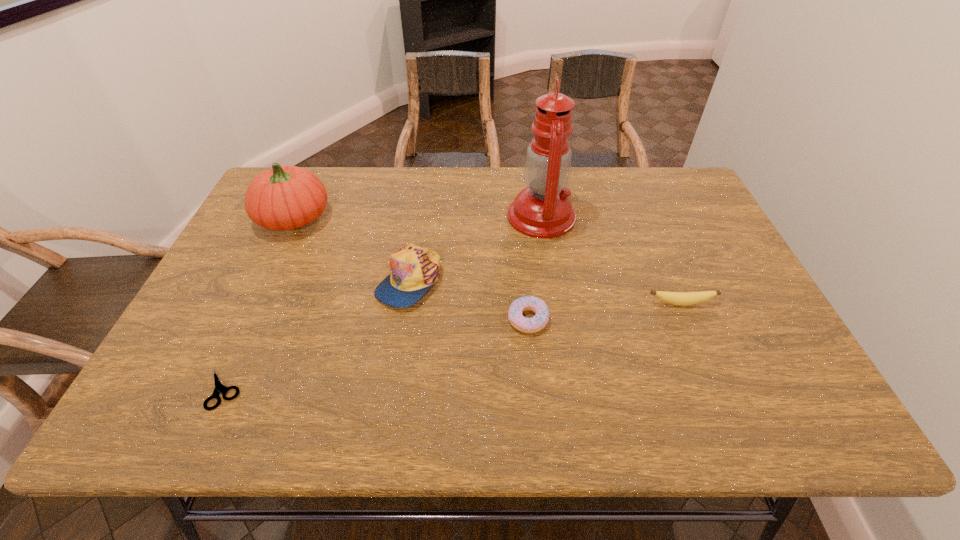
Choose which object is the fifth nearest neighbor to the banana. Please provide its 2D coordinates. Your answer should be formatted as a tuple, i.e. [(x, y)], where the tuple contains the x and y coordinates of a point satisfying the conditions above.

[(219, 388)]

Identify the location of free location that satisfies the following two spatial constraints: 1. on the bill of the fourth shortest object; 2. on the right side of the banana. (405, 303).

What are the coordinates of `vacant position in the image that satisfies the following two spatial constraints: 1. on the bill of the doughnut; 2. on the right side of the fourth shortest object` in the screenshot? It's located at (403, 319).

At what (x,y) coordinates should I click in order to perform the action: click on vacant region that satisfies the following two spatial constraints: 1. on the back side of the tallest object; 2. on the right side of the pumpkin. Please return your answer as a coordinate pair (x, y). Image resolution: width=960 pixels, height=540 pixels. Looking at the image, I should click on (295, 217).